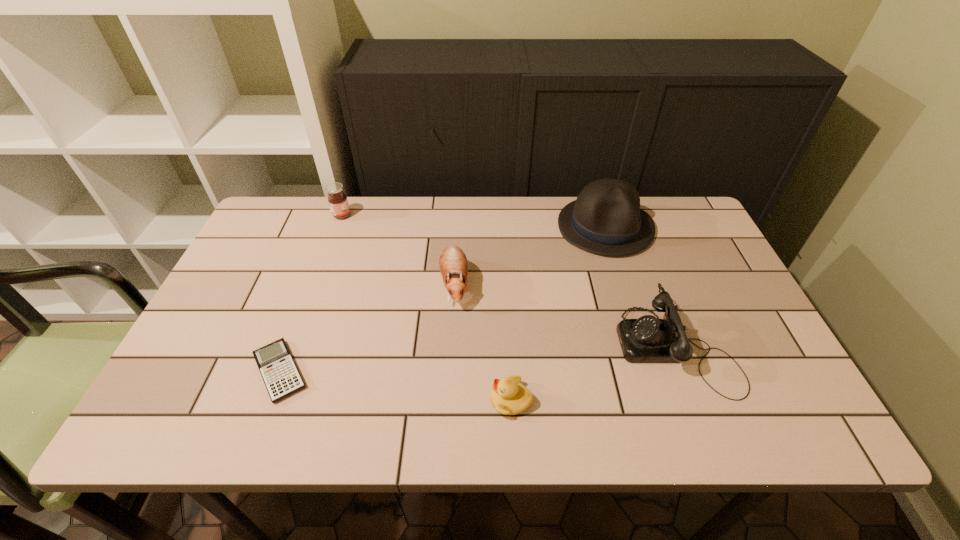
Locate an element on the screen. This screenshot has width=960, height=540. the tallest object is located at coordinates (606, 219).

The image size is (960, 540). I want to click on jam, so point(337,199).

At what (x,y) coordinates should I click in order to perform the action: click on telephone. Please return your answer as a coordinate pair (x, y). Looking at the image, I should click on (648, 339).

At what (x,y) coordinates should I click in order to perform the action: click on hamster. Please return your answer as a coordinate pair (x, y). This screenshot has width=960, height=540. Looking at the image, I should click on (453, 264).

The width and height of the screenshot is (960, 540). I want to click on duckling, so click(x=508, y=396).

The height and width of the screenshot is (540, 960). Find the location of `the third object from right to left`. the third object from right to left is located at coordinates (508, 396).

The width and height of the screenshot is (960, 540). I want to click on calculator, so click(x=279, y=372).

Locate an element on the screen. vacant space located 0.330m on the front-facing side of the bowler hat is located at coordinates (646, 356).

You are a GUI agent. You are given a task and a screenshot of the screen. Output one action in this format:
    pyautogui.click(x=<x>, y=<y>)
    Task: Click on the free space located 0.180m on the label side of the jam
    The height and width of the screenshot is (540, 960).
    Given the screenshot: What is the action you would take?
    pyautogui.click(x=408, y=215)

Locate an element on the screen. Image resolution: width=960 pixels, height=540 pixels. free space located 0.190m on the front-facing side of the telephone is located at coordinates (539, 347).